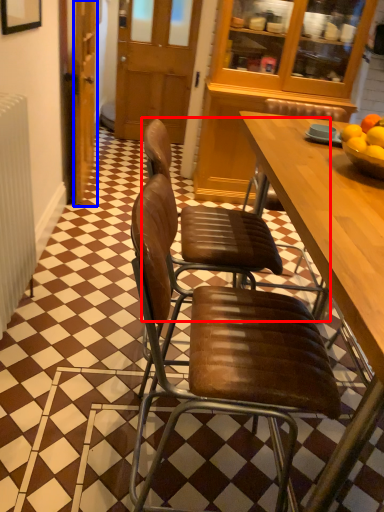
Question: Which of the following is the closest to the observer, chair (highlighted by a red box) or door (highlighted by a blue box)?

Choices:
 (A) chair
 (B) door

Answer: (A)